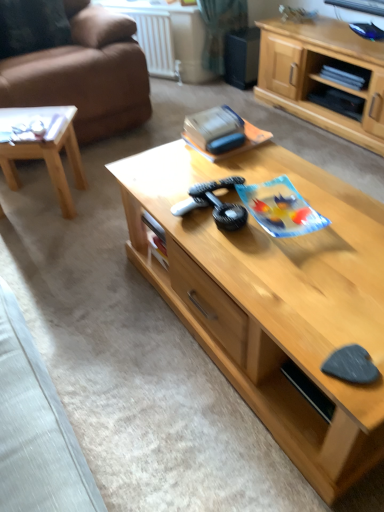
Question: Is velvet dark brown pillow at upper left bigger than light wood coffee table at center, which is counted as the second coffee table, starting from the left?

Choices:
 (A) no
 (B) yes

Answer: (A)

Question: Can you confirm if velvet dark brown pillow at upper left is taller than light wood coffee table at center, which is counted as the second coffee table, starting from the left?

Choices:
 (A) no
 (B) yes

Answer: (A)

Question: Can you confirm if velvet dark brown pillow at upper left is shorter than light wood coffee table at center, which is counted as the second coffee table, starting from the left?

Choices:
 (A) yes
 (B) no

Answer: (A)

Question: Is velvet dark brown pillow at upper left further to camera compared to light wood coffee table at center, acting as the 1th coffee table starting from the right?

Choices:
 (A) yes
 (B) no

Answer: (A)

Question: Is velvet dark brown pillow at upper left not inside light wood coffee table at center, acting as the 1th coffee table starting from the right?

Choices:
 (A) yes
 (B) no

Answer: (A)

Question: From a real-world perspective, is white plastic radiator at upper center physically located above or below light wood cabinet at center?

Choices:
 (A) above
 (B) below

Answer: (B)

Question: In terms of height, does white plastic radiator at upper center look taller or shorter compared to light wood cabinet at center?

Choices:
 (A) tall
 (B) short

Answer: (B)

Question: In the image, is white plastic radiator at upper center positioned in front of or behind light wood cabinet at center?

Choices:
 (A) behind
 (B) front

Answer: (A)

Question: Visually, is white plastic radiator at upper center positioned to the left or to the right of light wood cabinet at center?

Choices:
 (A) right
 (B) left

Answer: (B)

Question: Considering the positions of white plastic radiator at upper center and brown leather couch at left in the image, is white plastic radiator at upper center bigger or smaller than brown leather couch at left?

Choices:
 (A) big
 (B) small

Answer: (B)

Question: Considering the positions of point [x=163, y=57] and point [x=87, y=119], is point [x=163, y=57] closer or farther from the camera than point [x=87, y=119]?

Choices:
 (A) closer
 (B) farther

Answer: (B)

Question: Considering the positions of white plastic radiator at upper center and brown leather couch at left in the image, is white plastic radiator at upper center taller or shorter than brown leather couch at left?

Choices:
 (A) tall
 (B) short

Answer: (B)

Question: Considering their positions, is white plastic radiator at upper center located in front of or behind brown leather couch at left?

Choices:
 (A) behind
 (B) front

Answer: (A)

Question: Is brown leather couch at left to the left or to the right of light brown wood coffee table at left, positioned as the 1th coffee table in left-to-right order, in the image?

Choices:
 (A) left
 (B) right

Answer: (A)

Question: Considering the positions of point (114, 87) and point (41, 113), is point (114, 87) closer or farther from the camera than point (41, 113)?

Choices:
 (A) closer
 (B) farther

Answer: (B)